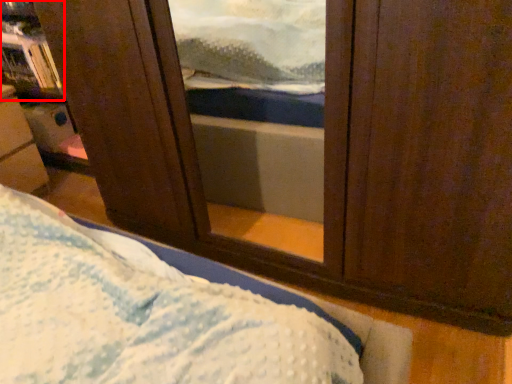
Question: In this image, where is bookshelf (annotated by the red box) located relative to furniture?

Choices:
 (A) left
 (B) right

Answer: (B)